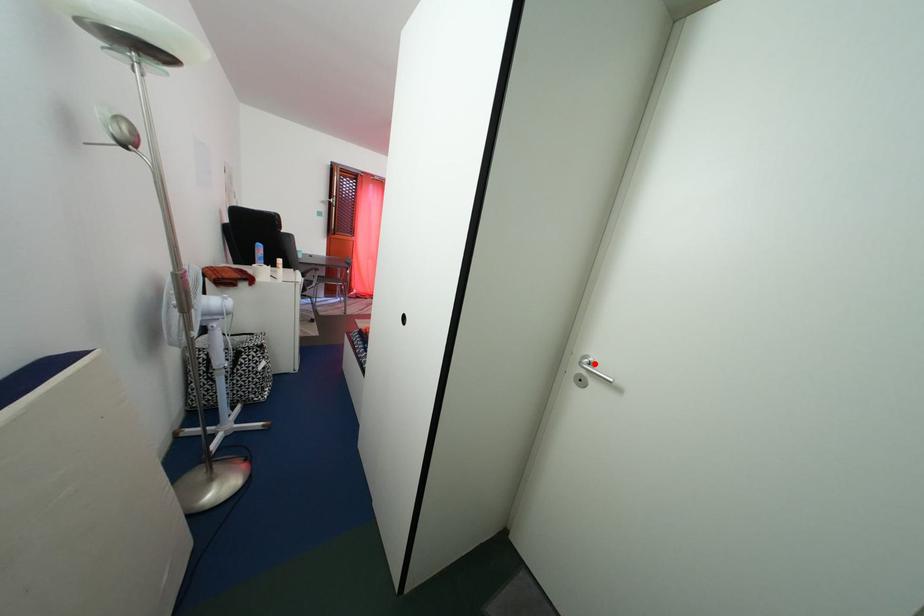
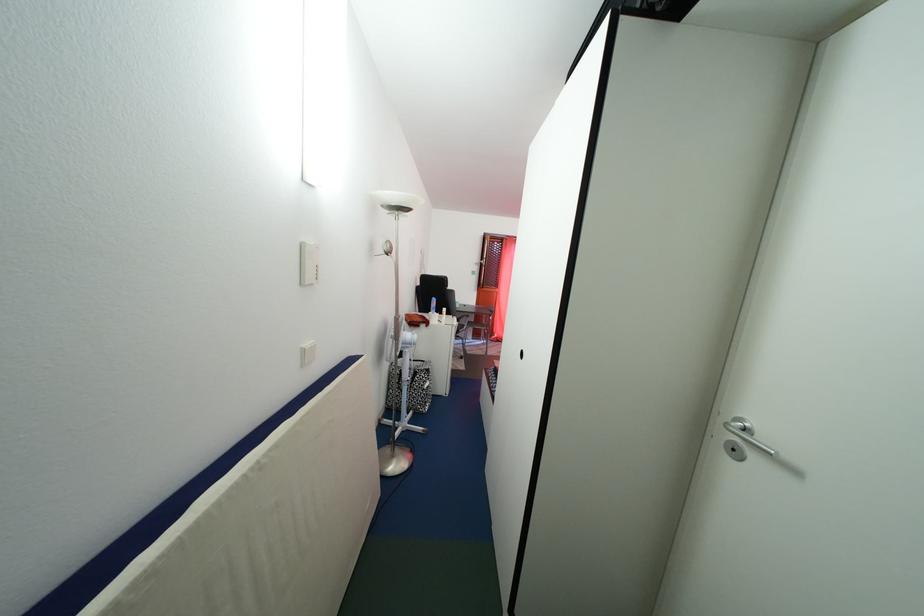
Find the pixel in the second image that matches the highlighted location in the first image.

(748, 426)